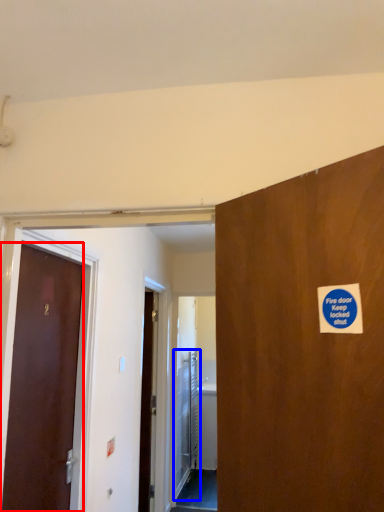
Question: Which object is further to the camera taking this photo, door (highlighted by a red box) or elevator door (highlighted by a blue box)?

Choices:
 (A) door
 (B) elevator door

Answer: (B)